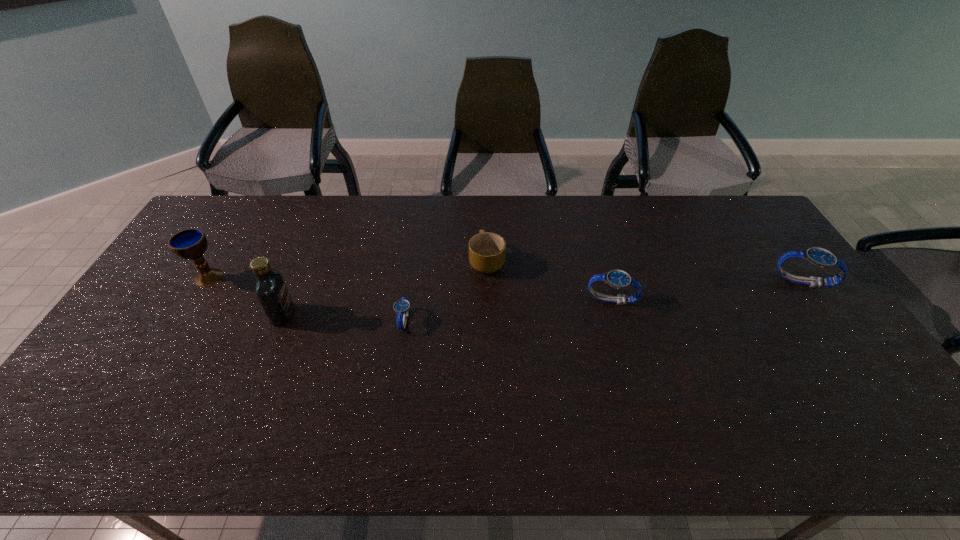
Find the location of a particular element. free space that satisfies the following two spatial constraints: 1. on the front side of the second watch from left to right; 2. on the right side of the chalice is located at coordinates (194, 300).